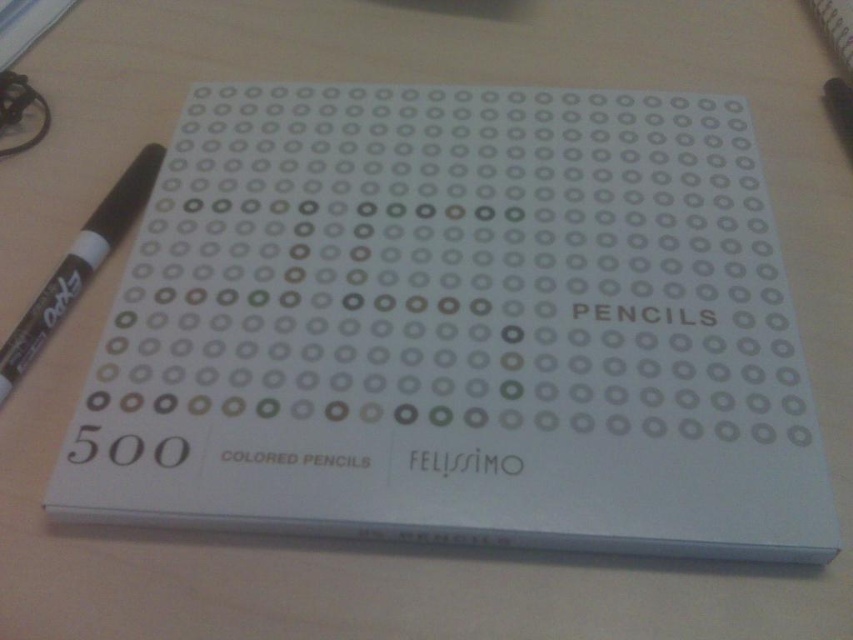
You are trying to place a small sticker exactly at the center of the white matte box of colored pencils at center. According to the coordinates provided, where should you place the sticker?

The sticker should be placed at the coordinates point (457, 326) since that is the exact center location of the white matte box of colored pencils at center as per the description.

From the picture: You are organizing a classroom and need to place the white matte box of colored pencils at center and the black marker at left into a drawer. The drawer has a height limit of 15 cm. Can both items fit vertically without exceeding the height limit?

The white matte box of colored pencils at center has a larger size compared to black marker at left. Since the box is larger, it might exceed the 15 cm height limit. However, the exact dimensions are not provided, so we cannot confirm if both will fit. Please check the actual height of the box.